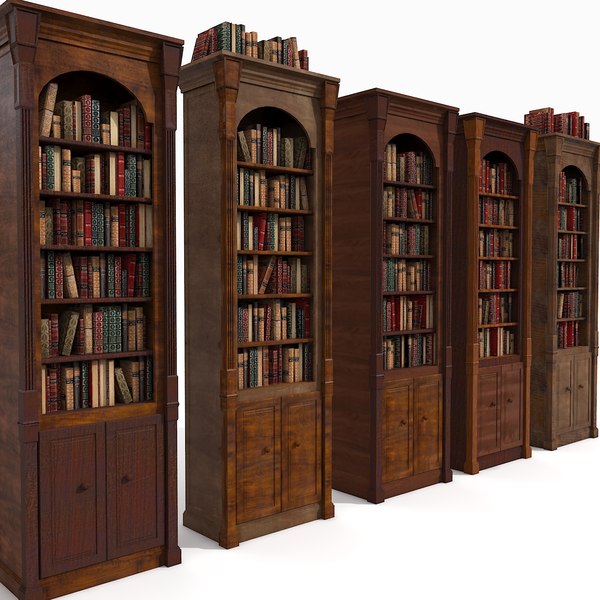
The width and height of the screenshot is (600, 600). What are the coordinates of `book case` in the screenshot? It's located at (79, 66), (253, 94), (391, 129), (502, 139), (574, 142).